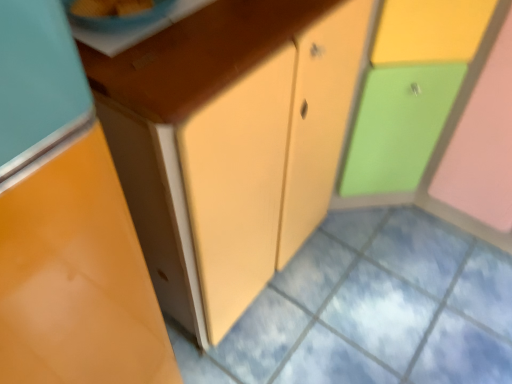
Question: Does blue glossy bowl at upper left lie in front of matte plastic cabinet at right, which is the 2th cabinetry in left-to-right order?

Choices:
 (A) yes
 (B) no

Answer: (A)

Question: Is blue glossy bowl at upper left oriented away from matte plastic cabinet at right, the 1th cabinetry in the right-to-left sequence?

Choices:
 (A) yes
 (B) no

Answer: (B)

Question: Could you tell me if blue glossy bowl at upper left is turned towards matte plastic cabinet at right, which is the 2th cabinetry in left-to-right order?

Choices:
 (A) no
 (B) yes

Answer: (A)

Question: Is blue glossy bowl at upper left at the left side of matte plastic cabinet at right, which is the 2th cabinetry in left-to-right order?

Choices:
 (A) no
 (B) yes

Answer: (B)

Question: From a real-world perspective, is blue glossy bowl at upper left on top of matte plastic cabinet at right, the 1th cabinetry in the right-to-left sequence?

Choices:
 (A) yes
 (B) no

Answer: (A)

Question: Would you say blue glossy bowl at upper left is a long distance from matte plastic cabinet at right, which is the 2th cabinetry in left-to-right order?

Choices:
 (A) yes
 (B) no

Answer: (B)

Question: Does matte orange cabinet at left, the first cabinetry viewed from the left, touch blue glossy bowl at upper left?

Choices:
 (A) no
 (B) yes

Answer: (A)

Question: Is matte orange cabinet at left, the first cabinetry viewed from the left, closer to camera compared to blue glossy bowl at upper left?

Choices:
 (A) no
 (B) yes

Answer: (B)

Question: From the image's perspective, would you say matte orange cabinet at left, marked as the 2th cabinetry in a right-to-left arrangement, is positioned over blue glossy bowl at upper left?

Choices:
 (A) no
 (B) yes

Answer: (A)

Question: Is matte orange cabinet at left, the first cabinetry viewed from the left, outside blue glossy bowl at upper left?

Choices:
 (A) no
 (B) yes

Answer: (B)

Question: Considering the relative sizes of matte orange cabinet at left, marked as the 2th cabinetry in a right-to-left arrangement, and blue glossy bowl at upper left in the image provided, is matte orange cabinet at left, marked as the 2th cabinetry in a right-to-left arrangement, thinner than blue glossy bowl at upper left?

Choices:
 (A) no
 (B) yes

Answer: (A)

Question: Can you confirm if matte orange cabinet at left, the first cabinetry viewed from the left, is smaller than blue glossy bowl at upper left?

Choices:
 (A) no
 (B) yes

Answer: (A)

Question: Is matte orange cabinet at left, the first cabinetry viewed from the left, beside matte yellow cabinet at center?

Choices:
 (A) yes
 (B) no

Answer: (B)